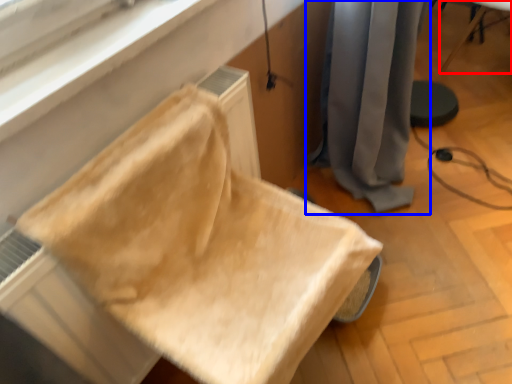
Question: Among these objects, which one is farthest to the camera, furniture (highlighted by a red box) or curtain (highlighted by a blue box)?

Choices:
 (A) furniture
 (B) curtain

Answer: (A)